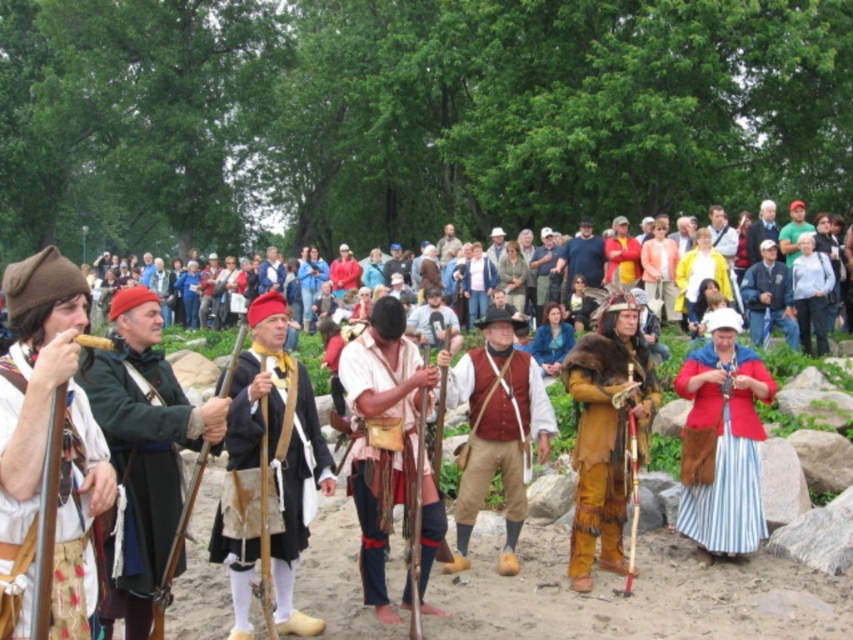
You are a photographer at the event and want to capture both the green woolen coat at left and the white cotton shirt at center in the same frame. Since you can only focus on one subject at a time, which one should you focus on to ensure the other remains in the background?

You should focus on the green woolen coat at left because it is in front of the white cotton shirt at center, so focusing on the foreground subject will keep the background subject in focus as well.

You are a photographer positioned at the back of the crowd. You want to capture a photo of both the brown fur coat at center and the blue denim jacket at center in the same frame. Given that your camera has a maximum focus range of 30 feet, will you be able to include both subjects in a single focused shot?

The distance between the brown fur coat at center and the blue denim jacket at center is 32.30 feet. Since your camera can only focus up to 30 feet, you won t be able to capture both subjects in a single focused shot.